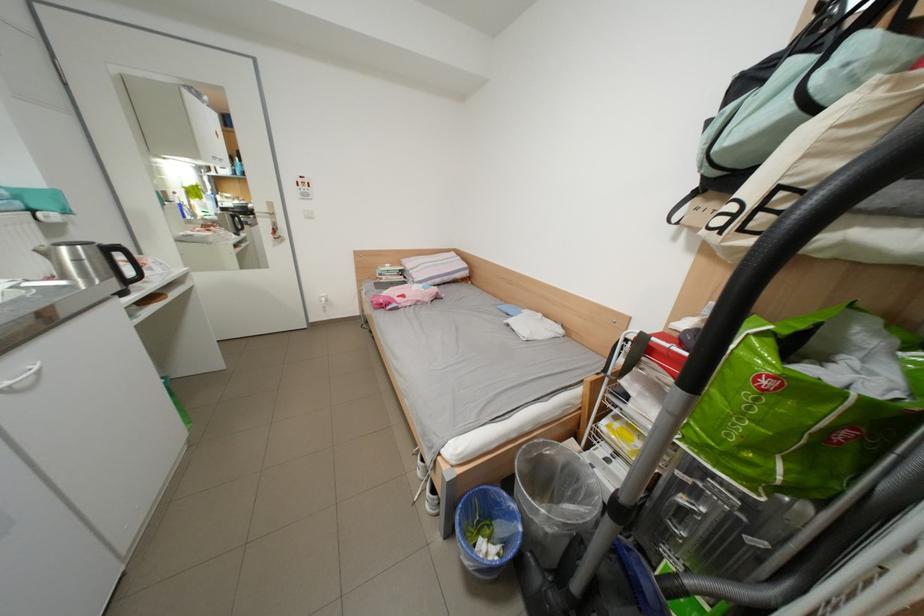
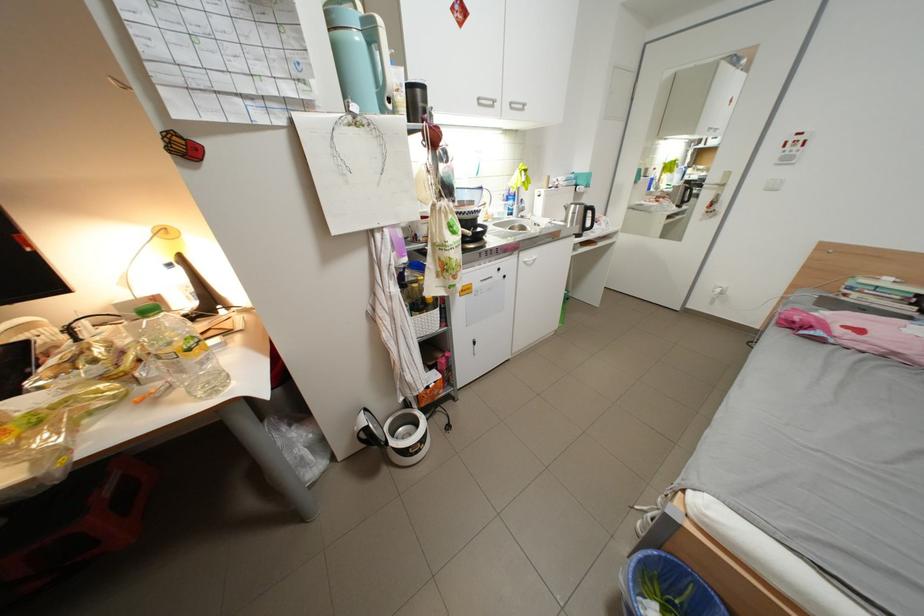
Find the pixel in the second image that matches [395,278] in the first image.

(867, 296)